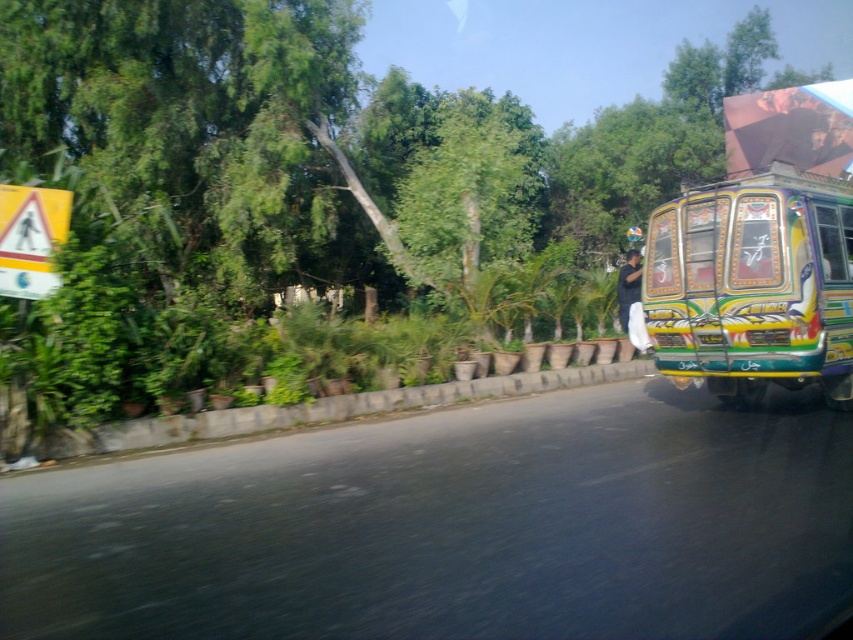
Who is shorter, decorative painted bus at right or black fabric man at right?

black fabric man at right

Identify the location of decorative painted bus at right. The width and height of the screenshot is (853, 640). click(x=753, y=285).

Locate an element on the screen. The width and height of the screenshot is (853, 640). decorative painted bus at right is located at coordinates click(753, 285).